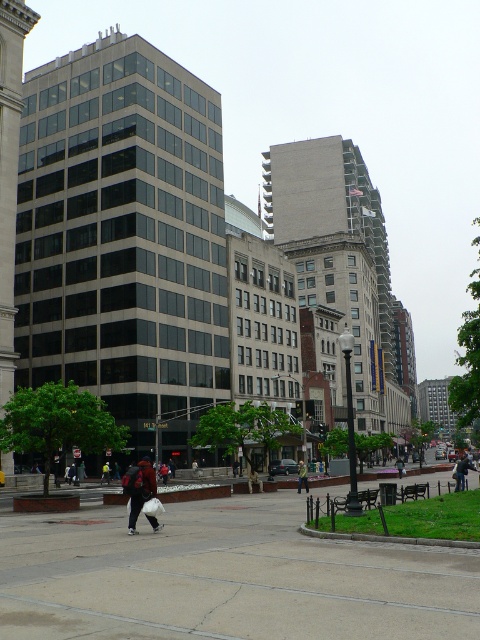
Question: Which of the following is the closest to the observer?

Choices:
 (A) dark gray jacket at center
 (B) dark brown leather backpack at center
 (C) green fabric jacket at center

Answer: (B)

Question: Is green fabric jacket at center further to camera compared to dark gray jacket at center?

Choices:
 (A) yes
 (B) no

Answer: (B)

Question: Is green fabric jacket at center below dark gray jacket at center?

Choices:
 (A) yes
 (B) no

Answer: (B)

Question: Which point appears farthest from the camera in this image?

Choices:
 (A) tap(134, 500)
 (B) tap(400, 467)
 (C) tap(303, 477)

Answer: (B)

Question: Does dark brown leather backpack at center lie in front of green fabric jacket at center?

Choices:
 (A) yes
 (B) no

Answer: (A)

Question: Which object is the farthest from the green fabric jacket at center?

Choices:
 (A) dark brown leather backpack at center
 (B) dark gray jacket at center

Answer: (A)